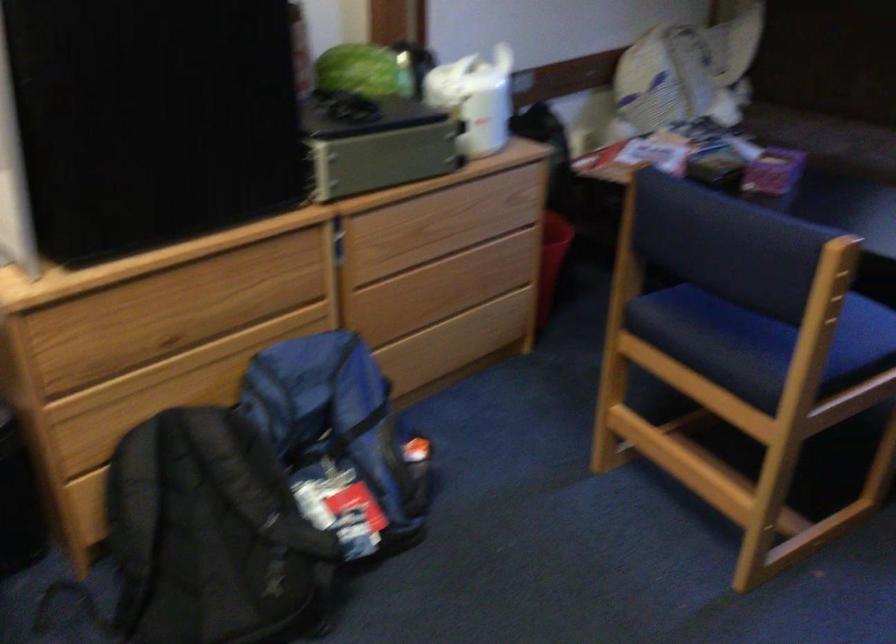
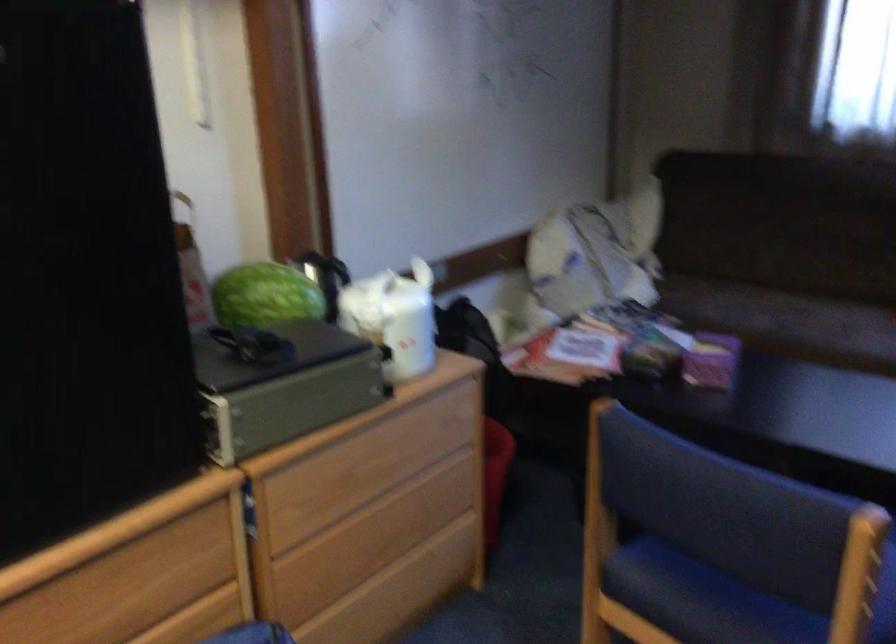
Question: The images are taken continuously from a first-person perspective. In which direction are you moving?

Choices:
 (A) Left
 (B) Right
 (C) Forward
 (D) Backward

Answer: (C)